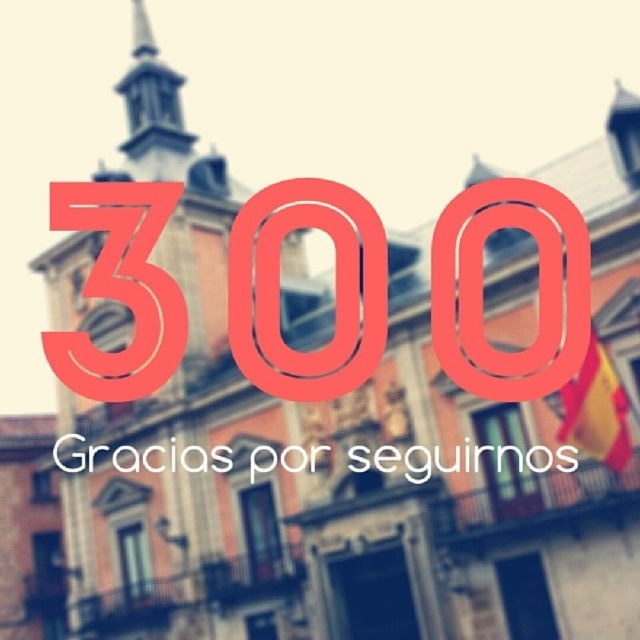
Question: Which point is farther from the camera taking this photo?

Choices:
 (A) (148, 58)
 (B) (176, 317)

Answer: (A)

Question: Can you confirm if metallic red number at center is positioned above smooth stone spire at upper left?

Choices:
 (A) no
 (B) yes

Answer: (A)

Question: Which point appears closest to the camera in this image?

Choices:
 (A) (304, 362)
 (B) (168, 161)

Answer: (A)

Question: Is metallic red number at center to the left of smooth stone spire at upper left from the viewer's perspective?

Choices:
 (A) yes
 (B) no

Answer: (B)

Question: Does metallic red number at center come behind smooth stone spire at upper left?

Choices:
 (A) yes
 (B) no

Answer: (B)